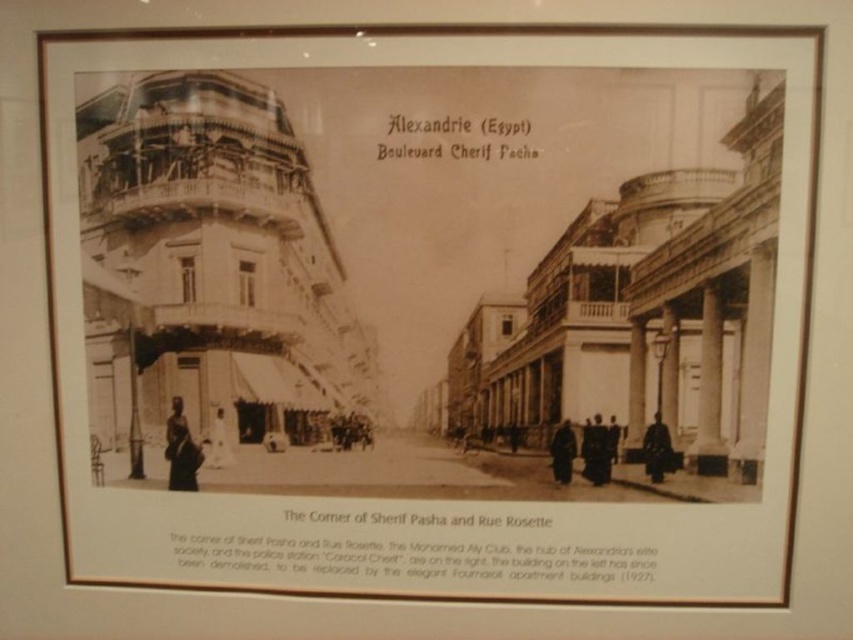
The image size is (853, 640). What do you see at coordinates (656, 449) in the screenshot?
I see `dark brown leather coat at right` at bounding box center [656, 449].

Is dark brown leather coat at right above dark skin person at center?

Actually, dark brown leather coat at right is below dark skin person at center.

Where is `dark brown leather coat at right`? The image size is (853, 640). dark brown leather coat at right is located at coordinates (656, 449).

Between dark skin figure at lower left and dark brown leather coat at right, which one appears on the right side from the viewer's perspective?

dark brown leather coat at right is more to the right.

The image size is (853, 640). In order to click on dark skin figure at lower left in this screenshot , I will do `click(181, 451)`.

Is point (178, 449) more distant than point (665, 461)?

Yes.

Find the location of `dark skin figure at lower left`. dark skin figure at lower left is located at coordinates (181, 451).

Can you confirm if black matte coat at center is wider than dark brown leather coat at right?

No, black matte coat at center is not wider than dark brown leather coat at right.

Is point (585, 476) positioned after point (647, 436)?

Yes, point (585, 476) is behind point (647, 436).

Locate an element on the screen. This screenshot has width=853, height=640. black matte coat at center is located at coordinates (596, 451).

At what (x,y) coordinates should I click in order to perform the action: click on black matte coat at center. Please return your answer as a coordinate pair (x, y). Looking at the image, I should click on pos(596,451).